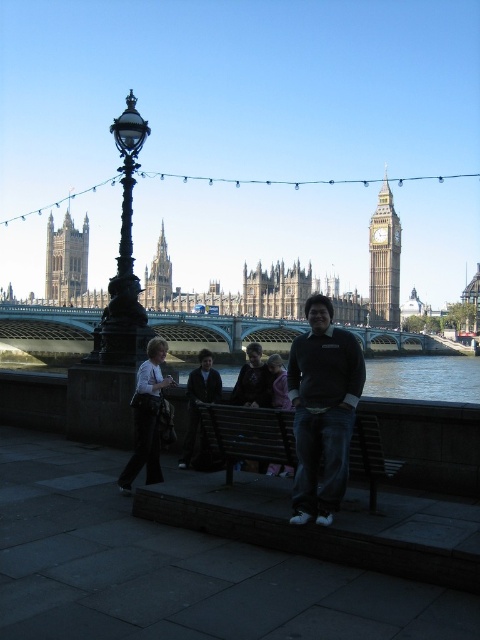
Is polished brass lamp post at left smaller than gold-colored clock tower at upper right?

No, polished brass lamp post at left is not smaller than gold-colored clock tower at upper right.

Which is behind, point (131, 120) or point (376, 218)?

Positioned behind is point (376, 218).

In order to click on polished brass lamp post at left in this screenshot , I will do `click(123, 259)`.

Can you confirm if gold-colored clock tower at upper right is shorter than purple fleece jacket at center?

Incorrect, gold-colored clock tower at upper right's height does not fall short of purple fleece jacket at center's.

Is point (392, 236) positioned before point (279, 381)?

No, it is behind (279, 381).

Does point (385, 186) come behind point (272, 362)?

That is True.

Image resolution: width=480 pixels, height=640 pixels. What are the coordinates of `gold-colored clock tower at upper right` in the screenshot? It's located at (384, 260).

Is brown wooden bench at center below dark blue water at lower center?

Actually, brown wooden bench at center is above dark blue water at lower center.

Who is more distant from viewer, (275, 420) or (397, 374)?

The point (397, 374) is more distant.

Find the location of a particular element. The width and height of the screenshot is (480, 640). brown wooden bench at center is located at coordinates (249, 435).

Identify the location of brown wooden bench at center. (249, 435).